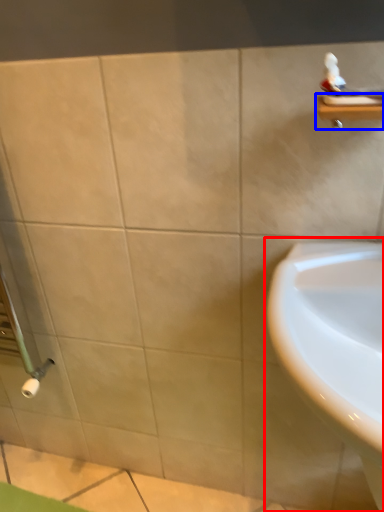
Question: Among these objects, which one is nearest to the camera, sink (highlighted by a red box) or balustrade (highlighted by a blue box)?

Choices:
 (A) sink
 (B) balustrade

Answer: (A)